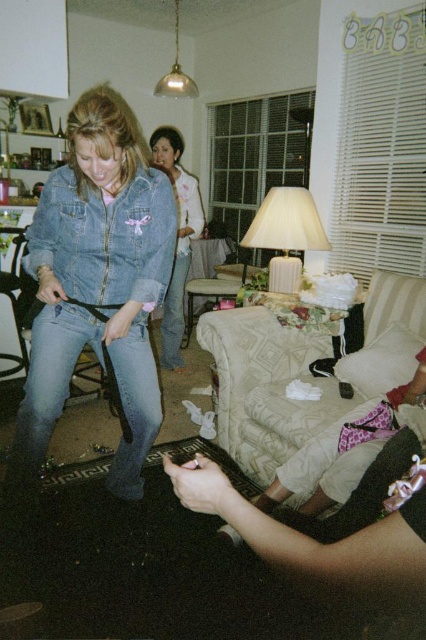
Question: Can you confirm if denim jeans at lower left is positioned below denim jacket at center?

Choices:
 (A) no
 (B) yes

Answer: (B)

Question: Which of the following is the closest to the observer?

Choices:
 (A) denim at left
 (B) denim jacket at center
 (C) denim jacket at lower left

Answer: (C)

Question: Which of the following is the closest to the observer?

Choices:
 (A) (175, 257)
 (B) (46, 413)

Answer: (B)

Question: Is denim jacket at center closer to camera compared to denim at left?

Choices:
 (A) no
 (B) yes

Answer: (B)

Question: Based on their relative distances, which object is farther from the denim at left?

Choices:
 (A) denim jacket at center
 (B) denim jacket at lower left

Answer: (B)

Question: Does denim jacket at lower left appear on the right side of denim at left?

Choices:
 (A) yes
 (B) no

Answer: (B)